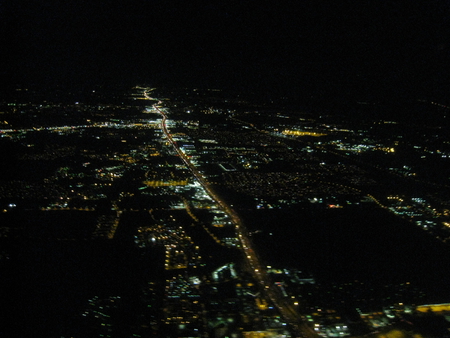
Locate an element on the screen. yellow glowing lights is located at coordinates (294, 133).